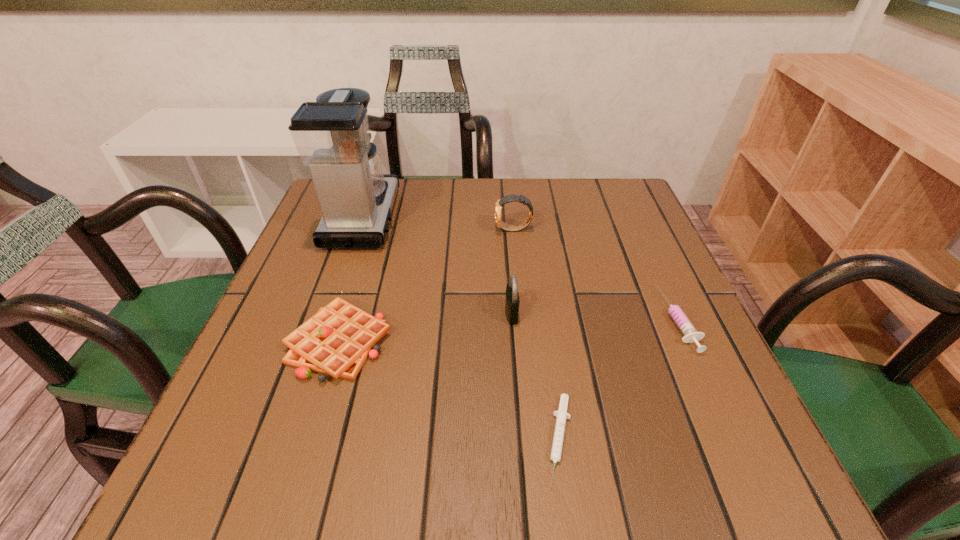
Locate which object is the fourth closest to the watch. Please provide its 2D coordinates. Your answer should be formatted as a tuple, i.e. [(x, y)], where the tuple contains the x and y coordinates of a point satisfying the conditions above.

[(337, 340)]

Where is `free space that satisfies the following two spatial constraints: 1. at the front of the tallest object where the controls are located; 2. on the left side of the third shortest object`? Image resolution: width=960 pixels, height=540 pixels. free space that satisfies the following two spatial constraints: 1. at the front of the tallest object where the controls are located; 2. on the left side of the third shortest object is located at coordinates (320, 342).

Image resolution: width=960 pixels, height=540 pixels. In order to click on free spot that satisfies the following two spatial constraints: 1. on the back side of the waffle; 2. on the left side of the padlock in this screenshot , I will do `click(348, 313)`.

You are a GUI agent. You are given a task and a screenshot of the screen. Output one action in this format:
    pyautogui.click(x=<x>, y=<y>)
    Task: Click on the blank space that satisfies the following two spatial constraints: 1. on the face of the watch; 2. on the back side of the shorter syringe
    The height and width of the screenshot is (540, 960).
    Given the screenshot: What is the action you would take?
    pyautogui.click(x=534, y=441)

Locate an element on the screen. The width and height of the screenshot is (960, 540). free space that satisfies the following two spatial constraints: 1. at the front of the coffee maker where the controls are located; 2. on the left side of the third shortest object is located at coordinates (320, 342).

Identify the location of free space that satisfies the following two spatial constraints: 1. on the back side of the farther syringe; 2. on the right side of the third shortest object. (346, 320).

The height and width of the screenshot is (540, 960). What are the coordinates of `vacant area that satisfies the following two spatial constraints: 1. on the front side of the rightmost object; 2. on the right side of the padlock` in the screenshot? It's located at (512, 320).

I want to click on free location that satisfies the following two spatial constraints: 1. at the front of the fifth tallest object where the controls are located; 2. on the left side of the tallest object, so click(x=327, y=320).